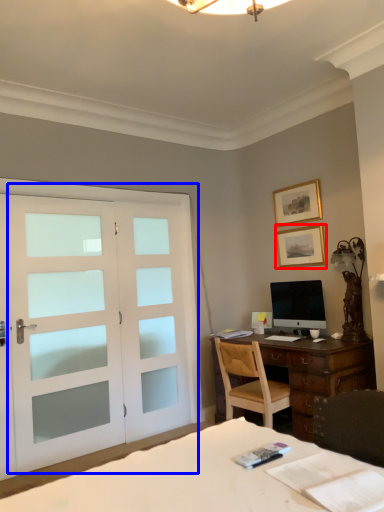
Question: Which point is closer to the camera, picture frame (highlighted by a red box) or door (highlighted by a blue box)?

Choices:
 (A) picture frame
 (B) door

Answer: (B)